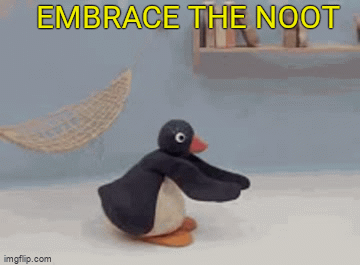
What are the coordinates of `books` in the screenshot? It's located at (205, 40), (217, 40), (227, 41), (234, 41), (247, 38), (288, 39).